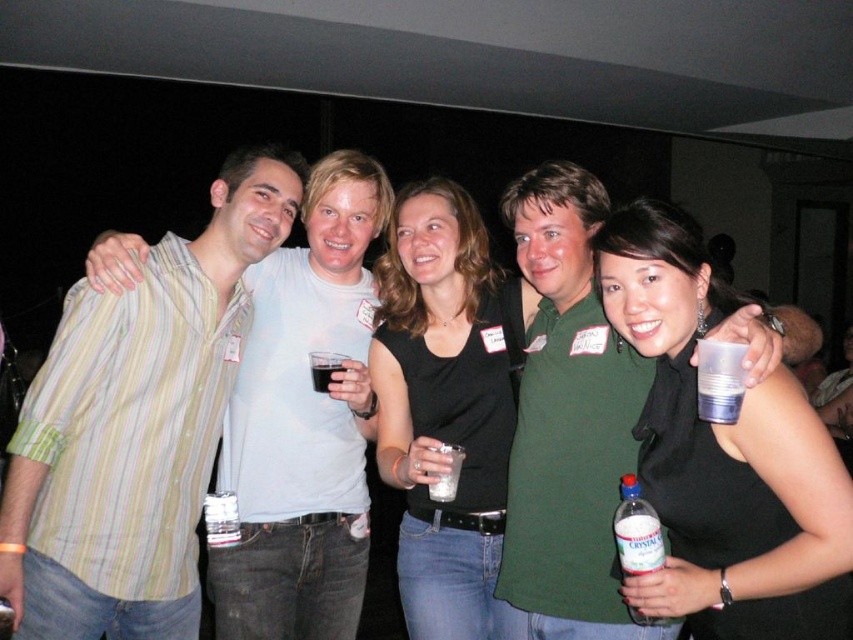
Question: Can you confirm if clear plastic bottle at lower right is positioned below dark liquid glass at center?

Choices:
 (A) no
 (B) yes

Answer: (B)

Question: Which object is the closest to the striped cotton shirt at left?

Choices:
 (A) black matte shirt at center
 (B) black matte tank top at center
 (C) clear plastic bottle at lower right
 (D) clear plastic bottle at center

Answer: (A)

Question: Based on their relative distances, which object is nearer to the black matte shirt at center?

Choices:
 (A) clear plastic bottle at lower right
 (B) striped cotton shirt at left
 (C) clear plastic bottle at center
 (D) dark liquid glass at center

Answer: (B)

Question: Which point is closer to the camera taking this photo?

Choices:
 (A) (213, 547)
 (B) (317, 456)

Answer: (A)

Question: In this image, where is black matte shirt at center located relative to clear plastic bottle at center?

Choices:
 (A) right
 (B) left

Answer: (A)

Question: Does striped cotton shirt at left have a greater width compared to clear plastic bottle at lower right?

Choices:
 (A) yes
 (B) no

Answer: (A)